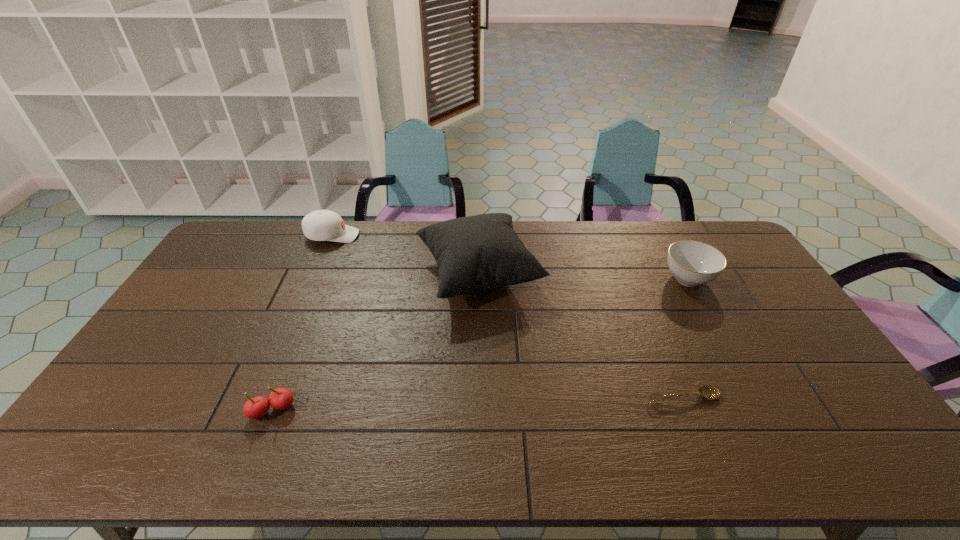
The image size is (960, 540). What are the coordinates of `vacant space that's between the chinaware and the shortest object` in the screenshot? It's located at (685, 339).

At what (x,y) coordinates should I click in order to perform the action: click on vacant region between the cherry and the chinaware. Please return your answer as a coordinate pair (x, y). This screenshot has height=540, width=960. Looking at the image, I should click on (480, 345).

Locate an element on the screen. This screenshot has height=540, width=960. vacant area between the chinaware and the third object from right to left is located at coordinates (584, 277).

At what (x,y) coordinates should I click in order to perform the action: click on vacant area that lies between the baseball cap and the tallest object. Please return your answer as a coordinate pair (x, y). Looking at the image, I should click on (405, 255).

Find the location of `empty space that is in between the shortest object and the chinaware`. empty space that is in between the shortest object and the chinaware is located at coordinates (685, 339).

The width and height of the screenshot is (960, 540). Identify the location of vacant region between the baseball cap and the shortest object. (508, 316).

Where is `vacant area between the chinaware and the cherry`? Image resolution: width=960 pixels, height=540 pixels. vacant area between the chinaware and the cherry is located at coordinates (480, 345).

Locate which object is the fourth closest to the baseball cap. Please provide its 2D coordinates. Your answer should be formatted as a tuple, i.e. [(x, y)], where the tuple contains the x and y coordinates of a point satisfying the conditions above.

[(710, 392)]

Locate which object ranks in proximity to the cherry. Please provide its 2D coordinates. Your answer should be formatted as a tuple, i.e. [(x, y)], where the tuple contains the x and y coordinates of a point satisfying the conditions above.

[(476, 253)]

You are a GUI agent. You are given a task and a screenshot of the screen. Output one action in this format:
    pyautogui.click(x=<x>, y=<y>)
    Task: Click on the free space that satisfies the following two spatial constraints: 1. on the front-facing side of the baseball cap; 2. on the back side of the ladle
    This screenshot has height=540, width=960.
    Given the screenshot: What is the action you would take?
    pyautogui.click(x=262, y=398)